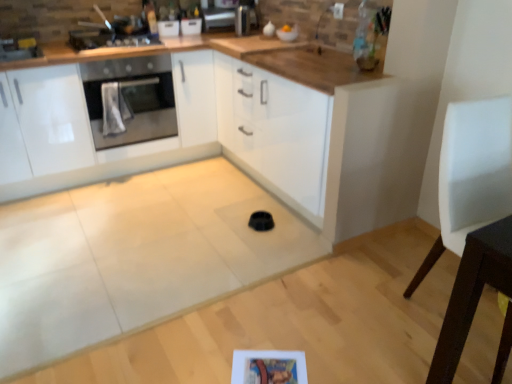
Locate an element on the screen. The height and width of the screenshot is (384, 512). vacant space that is to the left of white leather chair at right is located at coordinates (376, 310).